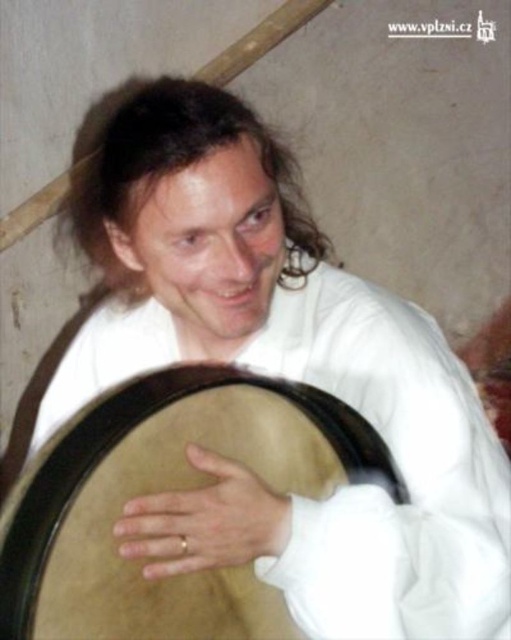
You are an interior designer planning to place a decorative item in a space. You have the light brown leather drum at lower center and the gold ring at center. Which object should you choose if you want the item to be more prominent in the room?

The light brown leather drum at lower center is larger in size compared to the gold ring at center, so it would be more prominent in the room.

You are a photographer trying to capture the light brown leather drum at lower center and the gold ring at center in a single frame. If you want to ensure both objects are fully visible without cropping, which object should you focus on to maintain their proportions?

The light brown leather drum at lower center has a larger width than the gold ring at center, so you should focus on the light brown leather drum at lower center to maintain their proportions while ensuring both are fully visible.

You are standing in front of the image and want to describe where the light brown leather drum at lower center is located. What coordinates would you use to describe its position?

The light brown leather drum at lower center is located at coordinates point (x=166, y=490).